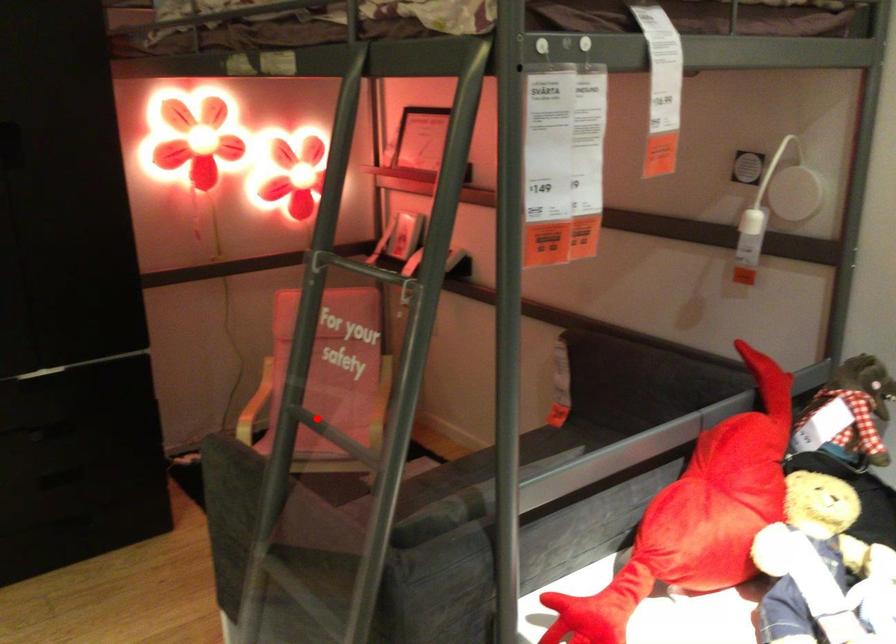
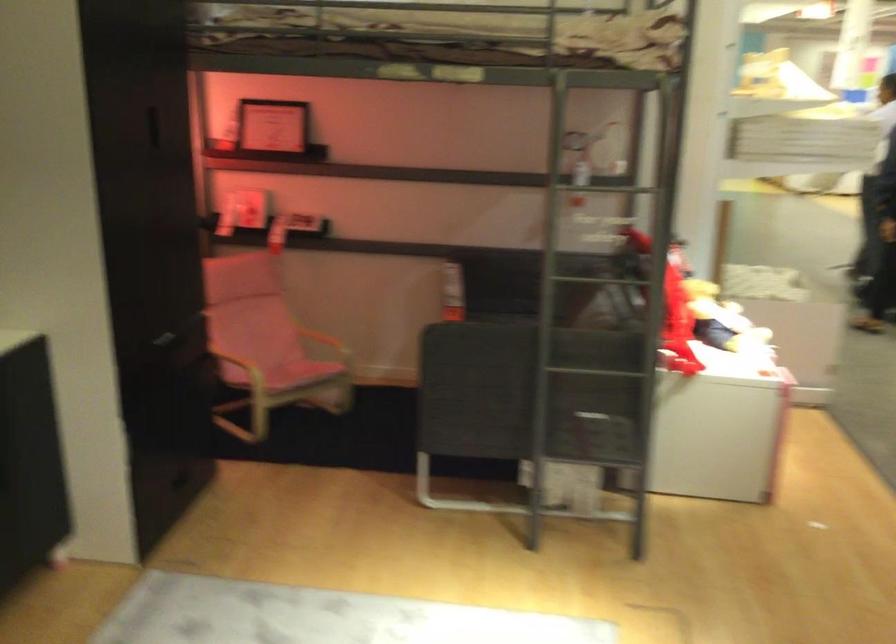
Question: I am providing you with two images of the same scene from different viewpoints. A red point is shown in image1. For the corresponding object point in image2, is it positioned nearer or farther from the camera?

Choices:
 (A) Nearer
 (B) Farther

Answer: (B)